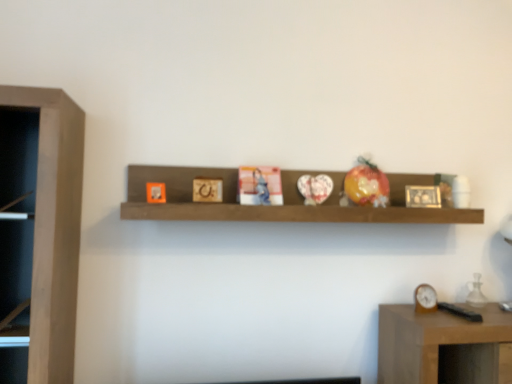
Question: From the image's perspective, is brown wooden shelf at center beneath brown wooden clock at right?

Choices:
 (A) no
 (B) yes

Answer: (A)

Question: Is brown wooden shelf at center to the right of brown wooden clock at right from the viewer's perspective?

Choices:
 (A) no
 (B) yes

Answer: (A)

Question: Does brown wooden shelf at center have a lesser height compared to brown wooden clock at right?

Choices:
 (A) no
 (B) yes

Answer: (A)

Question: From a real-world perspective, is brown wooden shelf at center below brown wooden clock at right?

Choices:
 (A) no
 (B) yes

Answer: (A)

Question: Does brown wooden shelf at center have a greater width compared to brown wooden clock at right?

Choices:
 (A) no
 (B) yes

Answer: (B)

Question: Is brown wooden shelf at center thinner than brown wooden clock at right?

Choices:
 (A) no
 (B) yes

Answer: (A)

Question: Is brown wooden clock at right located within wooden picture frame at center?

Choices:
 (A) no
 (B) yes

Answer: (A)

Question: Would you say wooden picture frame at center is a long distance from brown wooden clock at right?

Choices:
 (A) no
 (B) yes

Answer: (A)

Question: Considering the relative positions of wooden picture frame at center and brown wooden clock at right in the image provided, is wooden picture frame at center to the left of brown wooden clock at right from the viewer's perspective?

Choices:
 (A) yes
 (B) no

Answer: (A)

Question: Can you confirm if wooden picture frame at center is shorter than brown wooden clock at right?

Choices:
 (A) yes
 (B) no

Answer: (B)

Question: Does wooden picture frame at center have a greater height compared to brown wooden clock at right?

Choices:
 (A) yes
 (B) no

Answer: (A)

Question: From a real-world perspective, is wooden picture frame at center on top of brown wooden clock at right?

Choices:
 (A) no
 (B) yes

Answer: (B)

Question: From a real-world perspective, is brown wooden clock at right physically below brown wooden shelf at center?

Choices:
 (A) yes
 (B) no

Answer: (A)